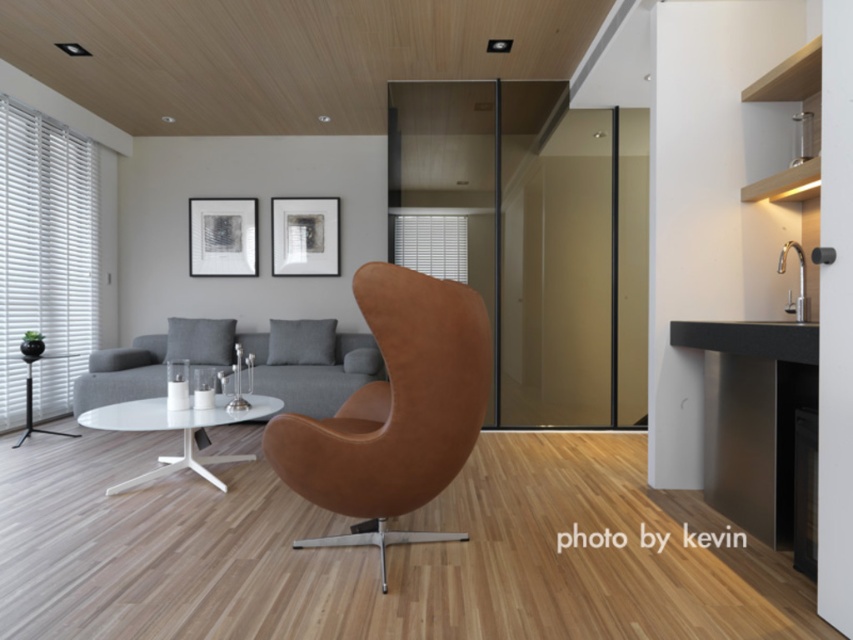
Does transparent glass door at center have a lesser width compared to white glossy glass table at center?

No.

Does transparent glass door at center have a greater height compared to white glossy glass table at center?

Correct, transparent glass door at center is much taller as white glossy glass table at center.

Is point (511, 356) closer to camera compared to point (231, 460)?

No, it is behind (231, 460).

Locate an element on the screen. The image size is (853, 640). transparent glass door at center is located at coordinates (531, 237).

Image resolution: width=853 pixels, height=640 pixels. What do you see at coordinates (393, 412) in the screenshot?
I see `tan leather swivel chair at center` at bounding box center [393, 412].

Does tan leather swivel chair at center have a smaller size compared to white glossy glass table at center?

Incorrect, tan leather swivel chair at center is not smaller in size than white glossy glass table at center.

Between point (473, 387) and point (160, 476), which one is positioned behind?

The point (160, 476) is behind.

Identify the location of tan leather swivel chair at center. (393, 412).

Can you confirm if transparent glass door at center is bigger than matte white coffee table at center?

No, transparent glass door at center is not bigger than matte white coffee table at center.

Does transparent glass door at center have a smaller size compared to matte white coffee table at center?

Indeed, transparent glass door at center has a smaller size compared to matte white coffee table at center.

Is point (495, 138) farther from camera compared to point (363, 342)?

No.

Find the location of a particular element. transparent glass door at center is located at coordinates (531, 237).